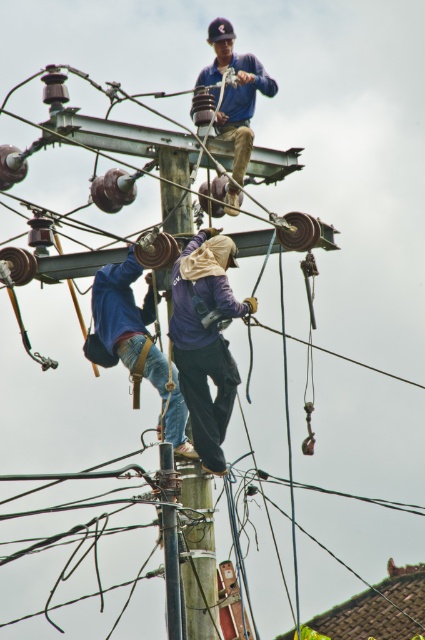
Between point (240, 179) and point (167, 448), which one is positioned in front?

Point (167, 448)

Who is positioned more to the right, blue denim shirt at upper center or wooden telegraph pole at center?

blue denim shirt at upper center

Who is more distant from viewer, (252, 104) or (172, 568)?

The point (252, 104) is behind.

Locate an element on the screen. The height and width of the screenshot is (640, 425). blue denim shirt at upper center is located at coordinates (235, 92).

Looking at this image, is blue denim jeans at center to the right of blue denim shirt at upper center from the viewer's perspective?

No, blue denim jeans at center is not to the right of blue denim shirt at upper center.

Can you confirm if blue denim jeans at center is positioned below blue denim shirt at upper center?

Yes, blue denim jeans at center is below blue denim shirt at upper center.

This screenshot has width=425, height=640. I want to click on blue denim jeans at center, so click(x=135, y=342).

Measure the distance between purple fabric construction worker at center and blue denim jeans at center.

purple fabric construction worker at center and blue denim jeans at center are 6.25 meters apart.

Does purple fabric construction worker at center have a smaller size compared to blue denim jeans at center?

Indeed, purple fabric construction worker at center has a smaller size compared to blue denim jeans at center.

Measure the distance between point (190,273) and camera.

A distance of 268.72 feet exists between point (190,273) and camera.

You are a GUI agent. You are given a task and a screenshot of the screen. Output one action in this format:
    pyautogui.click(x=<x>, y=<y>)
    Task: Click on the purple fabric construction worker at center
    
    Given the screenshot: What is the action you would take?
    pyautogui.click(x=206, y=339)